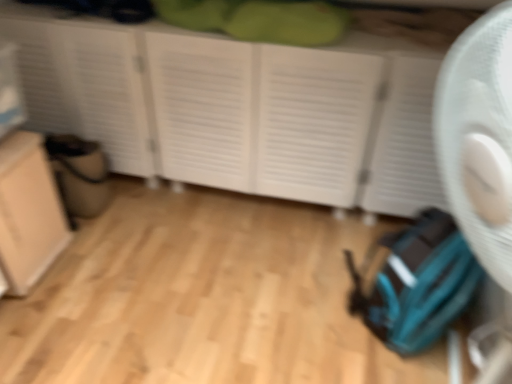
What do you see at coordinates (28, 212) in the screenshot?
I see `beige matte cabinet at lower left` at bounding box center [28, 212].

This screenshot has height=384, width=512. I want to click on beige matte cabinet at lower left, so click(x=28, y=212).

The height and width of the screenshot is (384, 512). In order to click on white matte cupboard at center in this screenshot , I will do `click(245, 111)`.

Describe the element at coordinates (245, 111) in the screenshot. I see `white matte cupboard at center` at that location.

Locate an element on the screen. Image resolution: width=512 pixels, height=384 pixels. beige matte cabinet at lower left is located at coordinates (28, 212).

Which is more to the left, beige matte cabinet at lower left or white matte cupboard at center?

Positioned to the left is beige matte cabinet at lower left.

In the image, is beige matte cabinet at lower left positioned in front of or behind white matte cupboard at center?

beige matte cabinet at lower left is in front of white matte cupboard at center.

Considering the points (39, 204) and (318, 156), which point is in front, point (39, 204) or point (318, 156)?

The point (39, 204) is closer to the camera.

From the image's perspective, is beige matte cabinet at lower left located beneath white matte cupboard at center?

Yes, from the image's perspective, beige matte cabinet at lower left is beneath white matte cupboard at center.

From a real-world perspective, who is located higher, beige matte cabinet at lower left or white matte cupboard at center?

In real-world perspective, white matte cupboard at center is above.

Based on the photo, can you confirm if beige matte cabinet at lower left is wider than white matte cupboard at center?

In fact, beige matte cabinet at lower left might be narrower than white matte cupboard at center.

Is beige matte cabinet at lower left taller or shorter than white matte cupboard at center?

beige matte cabinet at lower left is shorter than white matte cupboard at center.

In the scene shown: Considering the sizes of objects beige matte cabinet at lower left and white matte cupboard at center in the image provided, who is bigger, beige matte cabinet at lower left or white matte cupboard at center?

white matte cupboard at center is bigger.

Is beige matte cabinet at lower left located outside white matte cupboard at center?

Absolutely, beige matte cabinet at lower left is external to white matte cupboard at center.

Would you consider beige matte cabinet at lower left to be distant from white matte cupboard at center?

They are positioned close to each other.

Does beige matte cabinet at lower left turn towards white matte cupboard at center?

No, beige matte cabinet at lower left is not oriented towards white matte cupboard at center.

Where is `cabinetry that is below the white matte cupboard at center (from the image's perspective)`? This screenshot has height=384, width=512. cabinetry that is below the white matte cupboard at center (from the image's perspective) is located at coordinates (28, 212).

Which is more to the right, white matte cupboard at center or beige matte cabinet at lower left?

From the viewer's perspective, white matte cupboard at center appears more on the right side.

Considering the positions of objects white matte cupboard at center and beige matte cabinet at lower left in the image provided, who is behind, white matte cupboard at center or beige matte cabinet at lower left?

white matte cupboard at center is behind.

Which point is more forward, (192,55) or (9,253)?

The point (9,253) is closer.

From the image's perspective, which one is positioned higher, white matte cupboard at center or beige matte cabinet at lower left?

white matte cupboard at center is shown above in the image.

From a real-world perspective, is white matte cupboard at center above or below beige matte cabinet at lower left?

white matte cupboard at center is situated higher than beige matte cabinet at lower left in the real world.

Is white matte cupboard at center thinner than beige matte cabinet at lower left?

In fact, white matte cupboard at center might be wider than beige matte cabinet at lower left.

Based on the photo, is white matte cupboard at center shorter than beige matte cabinet at lower left?

Incorrect, the height of white matte cupboard at center does not fall short of that of beige matte cabinet at lower left.

Is white matte cupboard at center smaller than beige matte cabinet at lower left?

Incorrect, white matte cupboard at center is not smaller in size than beige matte cabinet at lower left.

Could beige matte cabinet at lower left be considered to be inside white matte cupboard at center?

That's incorrect, beige matte cabinet at lower left is not inside white matte cupboard at center.

Consider the image. Is white matte cupboard at center not close to beige matte cabinet at lower left?

No.

Is white matte cupboard at center turned away from beige matte cabinet at lower left?

No.

How many degrees apart are the facing directions of white matte cupboard at center and beige matte cabinet at lower left?

They differ by 89.2 degrees in their facing directions.

The height and width of the screenshot is (384, 512). Identify the location of cupboard located on the right of beige matte cabinet at lower left. (245, 111).

This screenshot has width=512, height=384. What are the coordinates of `cabinetry in front of the white matte cupboard at center` in the screenshot? It's located at (28, 212).

The image size is (512, 384). Find the location of `cupboard that appears on the right of beige matte cabinet at lower left`. cupboard that appears on the right of beige matte cabinet at lower left is located at coordinates (245, 111).